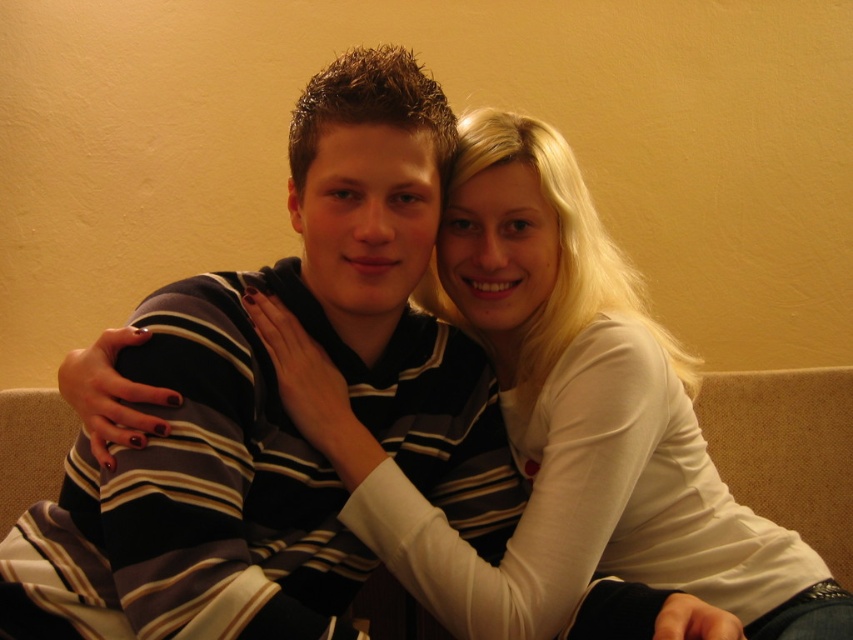
Can you confirm if striped cotton shirt at center is smaller than white matte shirt at upper right?

Correct, striped cotton shirt at center occupies less space than white matte shirt at upper right.

Can you confirm if striped cotton shirt at center is positioned below white matte shirt at upper right?

Indeed, striped cotton shirt at center is positioned under white matte shirt at upper right.

Is point (300, 518) farther from camera compared to point (786, 582)?

That is False.

At what (x,y) coordinates should I click in order to perform the action: click on striped cotton shirt at center. Please return your answer as a coordinate pair (x, y). This screenshot has width=853, height=640. Looking at the image, I should click on (280, 406).